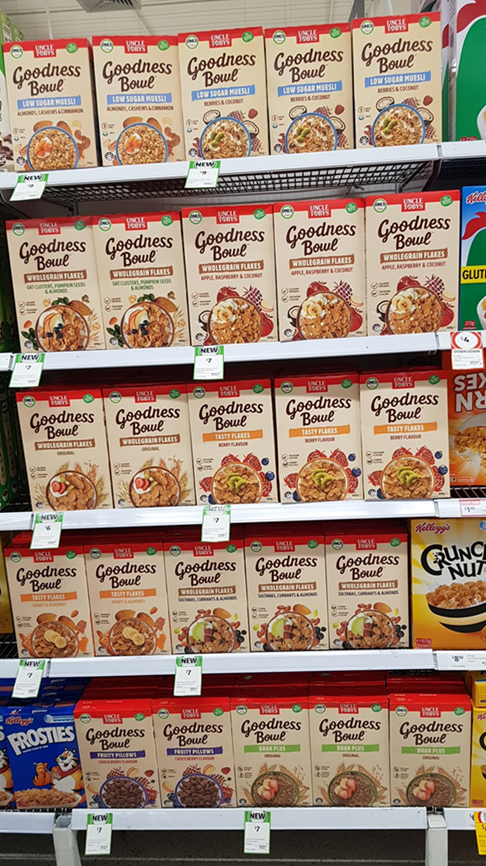
Find the location of a particular element. This screenshot has width=486, height=866. cereal box on second shelf down is located at coordinates tap(4, 335), tap(9, 326), tap(60, 322), tap(157, 314), tap(251, 301), tap(339, 301), tap(417, 300), tap(474, 293).